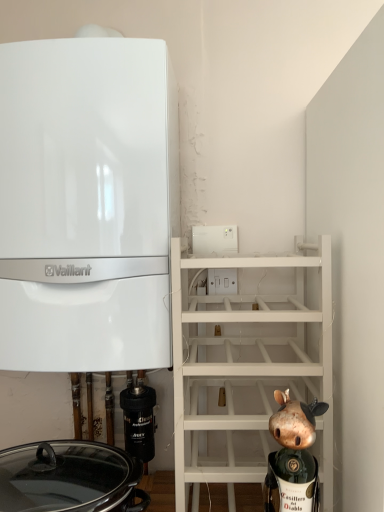
Question: In the image, is white glossy vaillant boiler at left on the left side or the right side of black glossy crock pot at lower left?

Choices:
 (A) right
 (B) left

Answer: (A)

Question: From the image's perspective, relative to black glossy crock pot at lower left, is white glossy vaillant boiler at left above or below?

Choices:
 (A) below
 (B) above

Answer: (B)

Question: Which object is positioned closest to the white matte shelf at upper right?

Choices:
 (A) gold metallic figurine at lower right
 (B) white glossy vaillant boiler at left
 (C) black rubber filter at lower left
 (D) white plastic electric outlet at center
 (E) black glossy crock pot at lower left

Answer: (A)

Question: Estimate the real-world distances between objects in this image. Which object is farther from the black glossy crock pot at lower left?

Choices:
 (A) gold metallic figurine at lower right
 (B) white plastic electric outlet at center
 (C) white glossy vaillant boiler at left
 (D) black rubber filter at lower left
 (E) white matte shelf at upper right

Answer: (B)